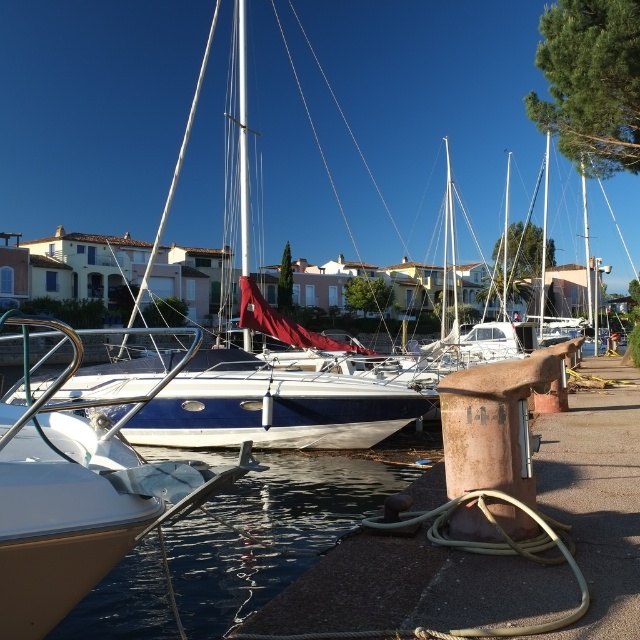
Question: Among these objects, which one is nearest to the camera?

Choices:
 (A) white glossy sailboat at center
 (B) clear water at lower left

Answer: (A)

Question: Does clear water at lower left appear on the right side of white glossy sailboat at center?

Choices:
 (A) yes
 (B) no

Answer: (A)

Question: Is clear water at lower left to the left of white glossy sailboat at center from the viewer's perspective?

Choices:
 (A) no
 (B) yes

Answer: (A)

Question: Which point is farther to the camera?

Choices:
 (A) clear water at lower left
 (B) white glossy sailboat at center

Answer: (A)

Question: Is clear water at lower left smaller than white glossy sailboat at center?

Choices:
 (A) yes
 (B) no

Answer: (A)